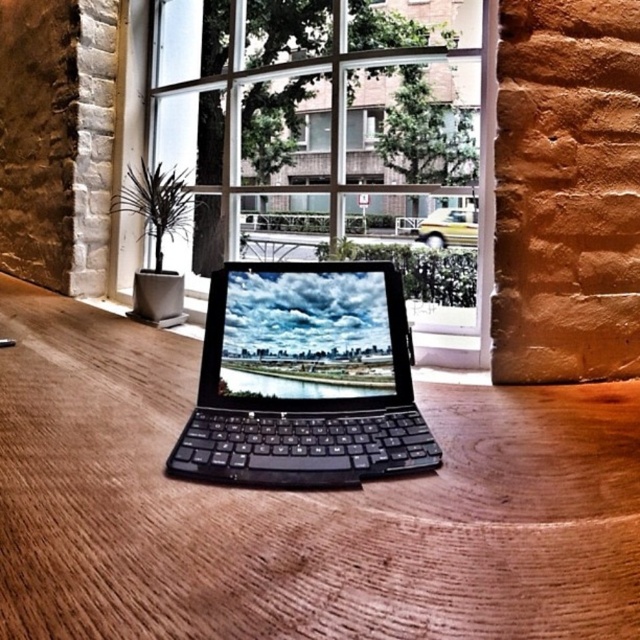
Between wooden table at center and black matte keyboard at center, which one has less height?

Standing shorter between the two is wooden table at center.

Who is more forward, (x=534, y=515) or (x=305, y=436)?

Point (x=534, y=515) is in front.

Which is behind, point (220, 576) or point (362, 438)?

Positioned behind is point (362, 438).

Where is `wooden table at center`? wooden table at center is located at coordinates (298, 508).

Who is positioned more to the left, black matte keyboard at center or transparent glass window at center?

From the viewer's perspective, transparent glass window at center appears more on the left side.

Consider the image. Does black matte keyboard at center have a lesser height compared to transparent glass window at center?

Correct, black matte keyboard at center is not as tall as transparent glass window at center.

I want to click on black matte keyboard at center, so click(x=305, y=378).

This screenshot has height=640, width=640. I want to click on black matte keyboard at center, so click(x=305, y=378).

Which of these two, transparent glass window at center or yellow matte car at center, stands taller?

With more height is transparent glass window at center.

Who is more forward, (488,60) or (467,244)?

Point (488,60)

Image resolution: width=640 pixels, height=640 pixels. What are the coordinates of `transparent glass window at center` in the screenshot? It's located at (344, 138).